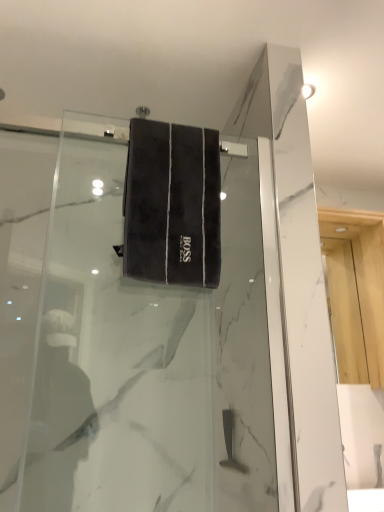
Identify the location of black plush towel at center. The image size is (384, 512). (172, 204).

What do you see at coordinates (172, 204) in the screenshot? Image resolution: width=384 pixels, height=512 pixels. I see `black plush towel at center` at bounding box center [172, 204].

Based on the photo, in order to face black plush towel at center, should I rotate leftwards or rightwards?

You should look left and rotate roughly 2.413 degrees.

Where is `black plush towel at center`? The image size is (384, 512). black plush towel at center is located at coordinates (172, 204).